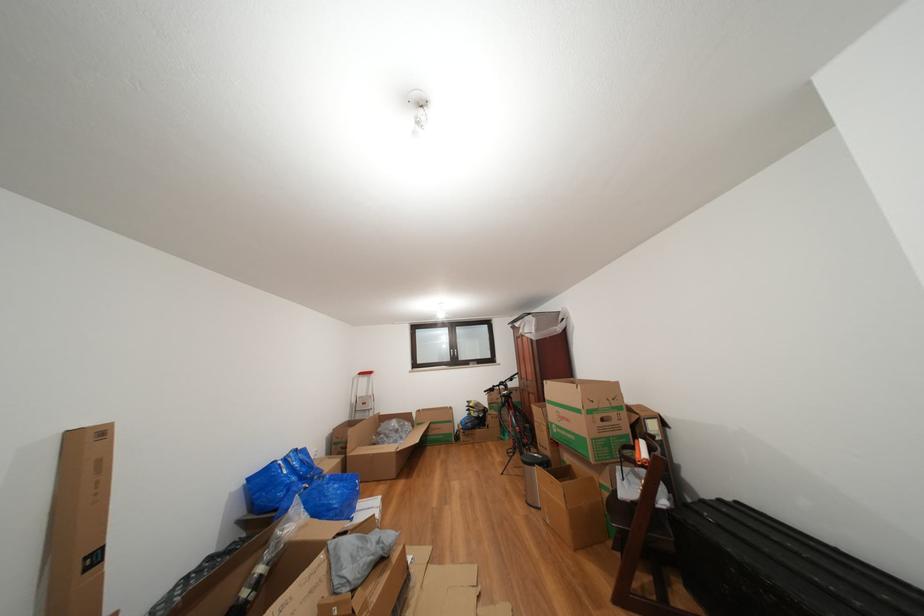
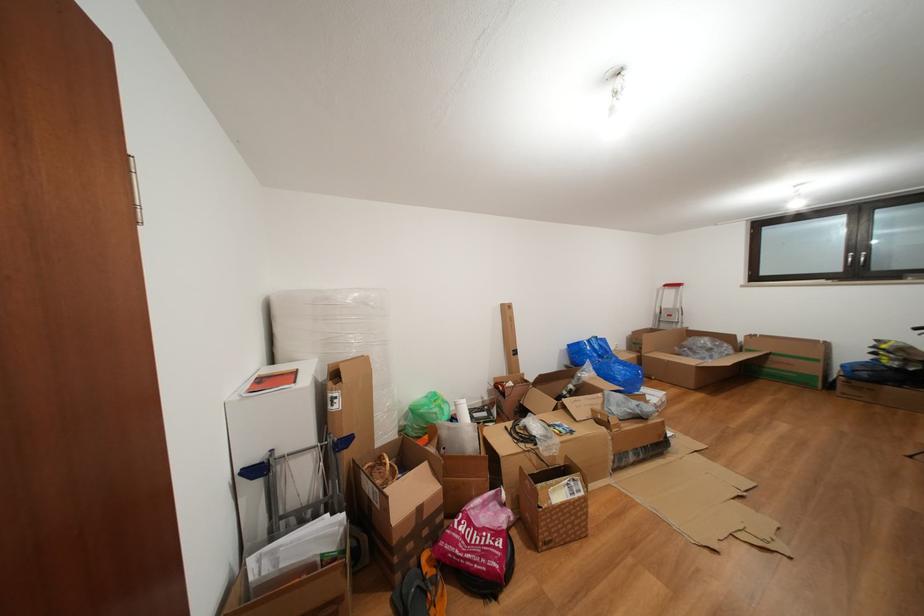
Locate, in the second image, the point that corresponds to point 458,427 in the first image.

(824, 366)